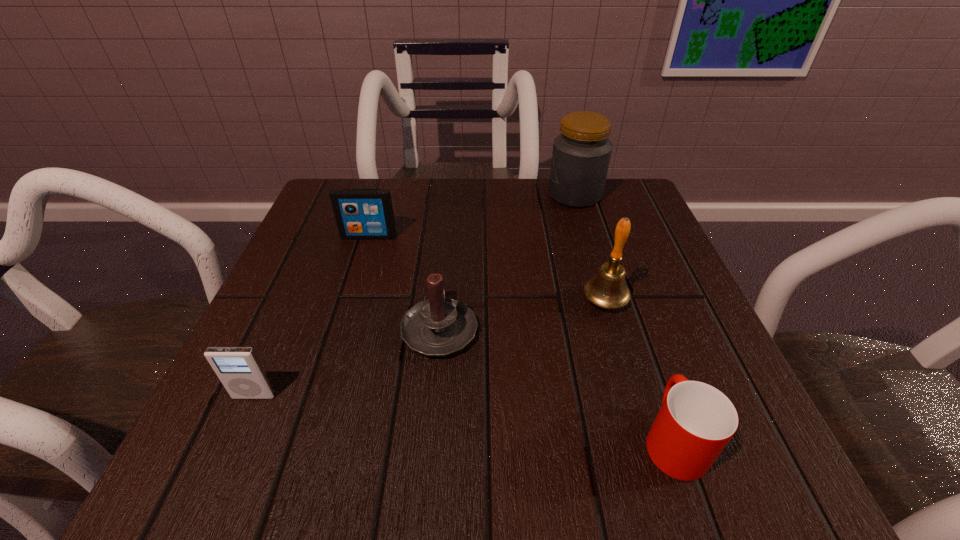
Locate an element on the screen. This screenshot has width=960, height=540. free space between the bell and the farthest object is located at coordinates (589, 248).

The height and width of the screenshot is (540, 960). I want to click on vacant area that lies between the cup and the candle, so click(x=557, y=384).

This screenshot has height=540, width=960. I want to click on empty space that is in between the farthest object and the right iPod, so click(x=471, y=215).

Identify which object is located as the third nearest to the fifth farthest object. Please provide its 2D coordinates. Your answer should be formatted as a tuple, i.e. [(x, y)], where the tuple contains the x and y coordinates of a point satisfying the conditions above.

[(608, 290)]

You are a GUI agent. You are given a task and a screenshot of the screen. Output one action in this format:
    pyautogui.click(x=<x>, y=<y>)
    Task: Click on the object that is the fifth nearest to the farthest object
    The height and width of the screenshot is (540, 960).
    Given the screenshot: What is the action you would take?
    pyautogui.click(x=240, y=371)

Image resolution: width=960 pixels, height=540 pixels. What are the coordinates of `vacant position in the image that satisfies the following two spatial constraints: 1. on the surface of the farthest object near the warning symbol; 2. on the front-facing side of the nearer iPod` in the screenshot? It's located at (635, 396).

This screenshot has height=540, width=960. I want to click on free location that satisfies the following two spatial constraints: 1. on the side of the bell with the handle loop; 2. on the left side of the fourth object from right to left, so click(443, 301).

This screenshot has width=960, height=540. What are the coordinates of `blank area in the image that satisfies the following two spatial constraints: 1. on the surface of the jar near the warning symbol; 2. on the front-facing side of the nearer iPod` in the screenshot? It's located at (635, 396).

What are the coordinates of `free space that satisfies the following two spatial constraints: 1. on the front screen of the bell; 2. on the right side of the second object from left to right` in the screenshot? It's located at (348, 301).